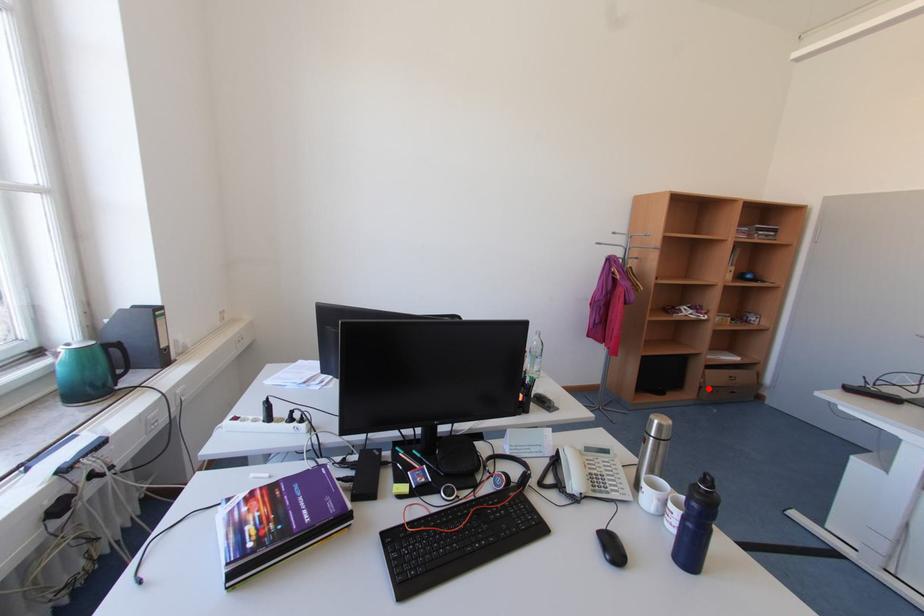
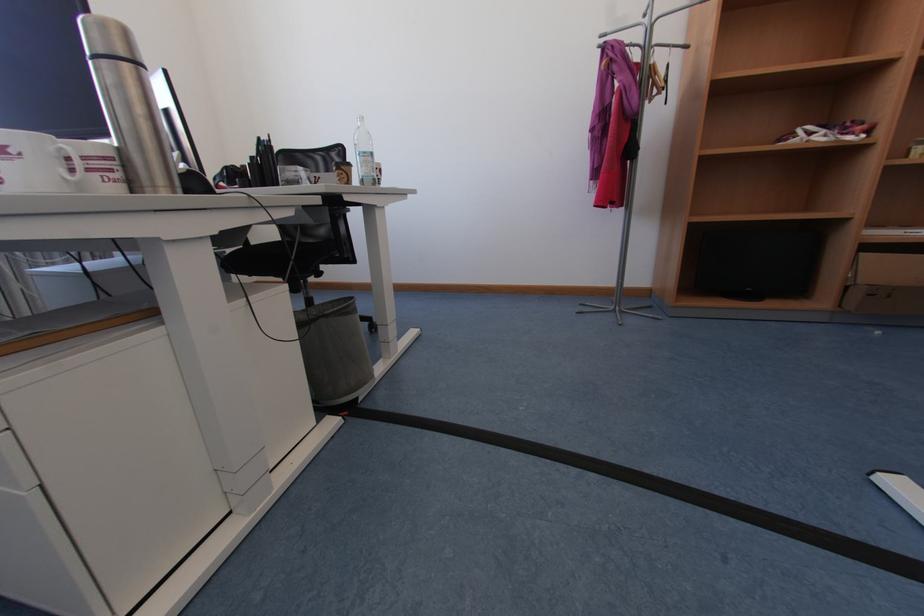
Locate, in the second image, the point that corresponds to the highlighted location in the first image.

(855, 289)